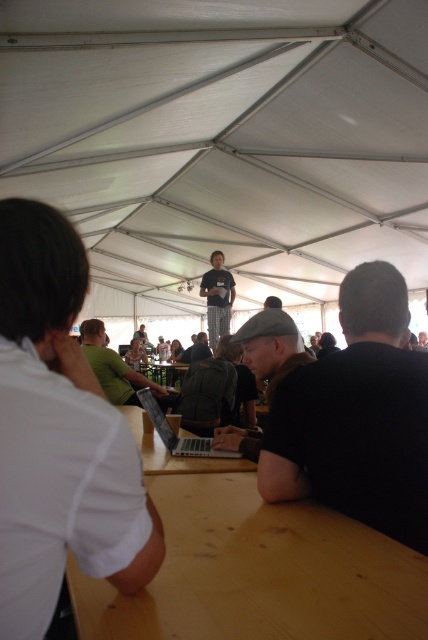
The height and width of the screenshot is (640, 428). What do you see at coordinates (356, 417) in the screenshot?
I see `black matte shirt at center` at bounding box center [356, 417].

Who is higher up, black matte shirt at center or silver metallic laptop at center?

black matte shirt at center

Does point (383, 365) come farther from viewer compared to point (219, 456)?

No, it is not.

Where is `black matte shirt at center`? black matte shirt at center is located at coordinates (356, 417).

Is dark gray shirt at center bigger than light brown wooden table at center?

No, dark gray shirt at center is not bigger than light brown wooden table at center.

This screenshot has height=640, width=428. What do you see at coordinates (217, 298) in the screenshot?
I see `dark gray shirt at center` at bounding box center [217, 298].

This screenshot has height=640, width=428. Identify the location of dark gray shirt at center. (217, 298).

Who is more forward, (x=231, y=282) or (x=154, y=422)?

Point (x=154, y=422) is in front.

Where is `dark gray shirt at center`? dark gray shirt at center is located at coordinates click(217, 298).